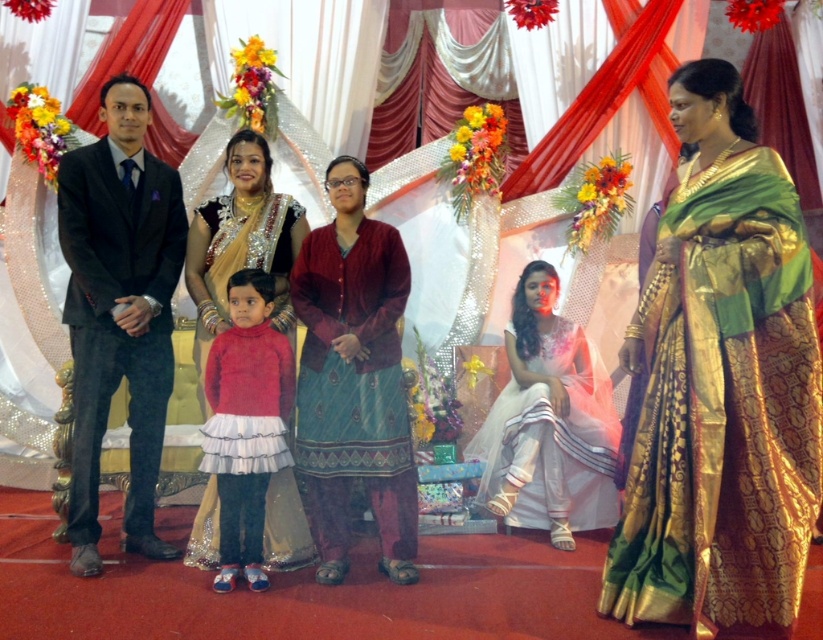
Question: Which object is farther from the camera taking this photo?

Choices:
 (A) white silk dress at lower center
 (B) matte red sweater at center

Answer: (A)

Question: Which of the following is the farthest from the observer?

Choices:
 (A) (287, 417)
 (B) (375, 337)
 (C) (558, 368)
 (D) (129, 428)

Answer: (C)

Question: Is green silk saree at center wider than matte red sweater at center?

Choices:
 (A) yes
 (B) no

Answer: (A)

Question: Can you confirm if green silk saree at center is thinner than matte red sweater at center?

Choices:
 (A) no
 (B) yes

Answer: (A)

Question: Which of the following is the closest to the observer?

Choices:
 (A) green silk saree at center
 (B) matte red sweater at center

Answer: (A)

Question: Does dark gray suit at left have a smaller size compared to matte red sweater at center?

Choices:
 (A) no
 (B) yes

Answer: (A)